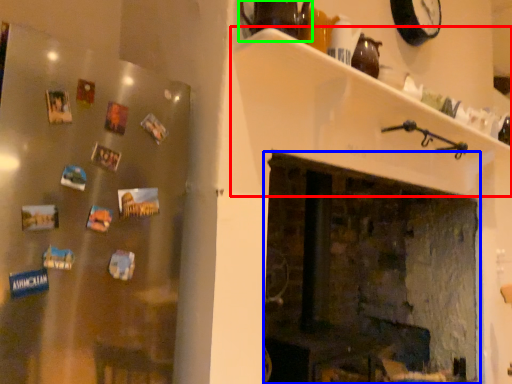
Question: Which is nearer to the shelf (highlighted by a red box)? fireplace (highlighted by a blue box) or tea pot (highlighted by a green box).

Choices:
 (A) fireplace
 (B) tea pot

Answer: (B)